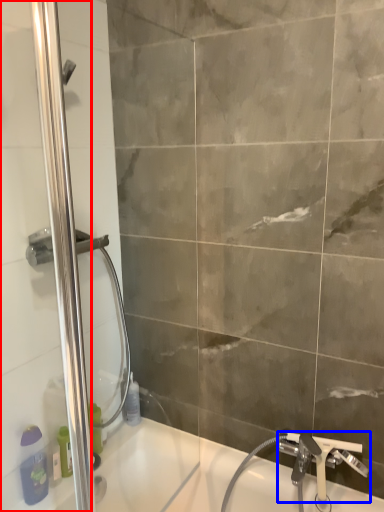
Question: Which point is closer to the camera, screen door (highlighted by a red box) or tap (highlighted by a blue box)?

Choices:
 (A) screen door
 (B) tap

Answer: (A)